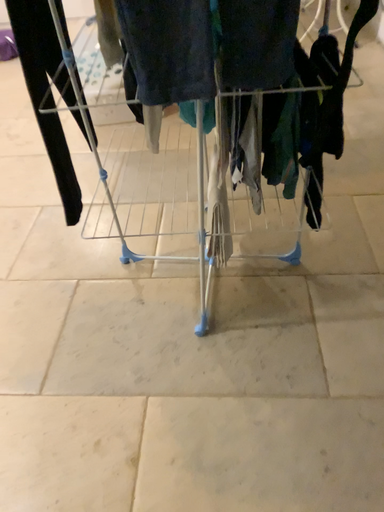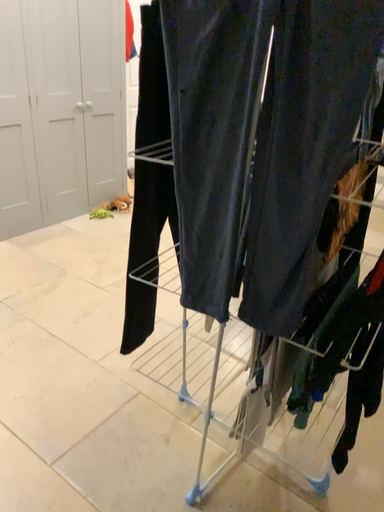
Question: How did the camera likely rotate when shooting the video?

Choices:
 (A) rotated right
 (B) rotated left

Answer: (B)